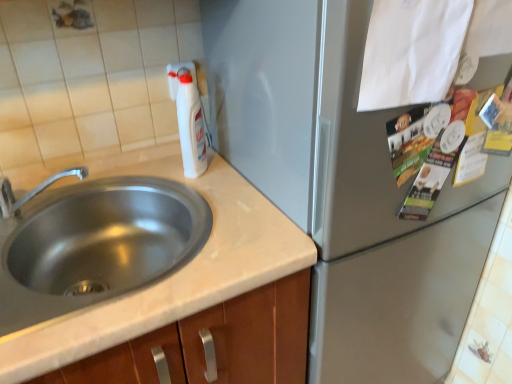
Question: Is white paper at upper right smaller than satin silver refrigerator at center?

Choices:
 (A) yes
 (B) no

Answer: (A)

Question: From a real-world perspective, is white paper at upper right located beneath satin silver refrigerator at center?

Choices:
 (A) yes
 (B) no

Answer: (B)

Question: Is white paper at upper right at the right side of satin silver refrigerator at center?

Choices:
 (A) no
 (B) yes

Answer: (A)

Question: Considering the relative positions of white paper at upper right and satin silver refrigerator at center in the image provided, is white paper at upper right behind satin silver refrigerator at center?

Choices:
 (A) no
 (B) yes

Answer: (A)

Question: Is white paper at upper right to the left of satin silver refrigerator at center from the viewer's perspective?

Choices:
 (A) no
 (B) yes

Answer: (B)

Question: Considering the positions of white paper at upper right and satin silver refrigerator at center in the image, is white paper at upper right wider or thinner than satin silver refrigerator at center?

Choices:
 (A) thin
 (B) wide

Answer: (A)

Question: Do you think white paper at upper right is within satin silver refrigerator at center, or outside of it?

Choices:
 (A) outside
 (B) inside

Answer: (B)

Question: Considering the relative positions of white paper at upper right and satin silver refrigerator at center in the image provided, is white paper at upper right to the left or to the right of satin silver refrigerator at center?

Choices:
 (A) right
 (B) left

Answer: (B)

Question: Considering the positions of point (392, 66) and point (395, 221), is point (392, 66) closer or farther from the camera than point (395, 221)?

Choices:
 (A) closer
 (B) farther

Answer: (A)

Question: Considering the positions of stainless steel sink at left and brushed metal faucet at left in the image, is stainless steel sink at left taller or shorter than brushed metal faucet at left?

Choices:
 (A) short
 (B) tall

Answer: (B)

Question: Considering the positions of stainless steel sink at left and brushed metal faucet at left in the image, is stainless steel sink at left wider or thinner than brushed metal faucet at left?

Choices:
 (A) wide
 (B) thin

Answer: (A)

Question: Choose the correct answer: Is stainless steel sink at left inside brushed metal faucet at left or outside it?

Choices:
 (A) inside
 (B) outside

Answer: (B)

Question: From the image's perspective, is stainless steel sink at left above or below brushed metal faucet at left?

Choices:
 (A) below
 (B) above

Answer: (A)

Question: In the image, is satin silver refrigerator at center positioned in front of or behind stainless steel sink at left?

Choices:
 (A) behind
 (B) front

Answer: (B)

Question: From a real-world perspective, is satin silver refrigerator at center above or below stainless steel sink at left?

Choices:
 (A) below
 (B) above

Answer: (A)